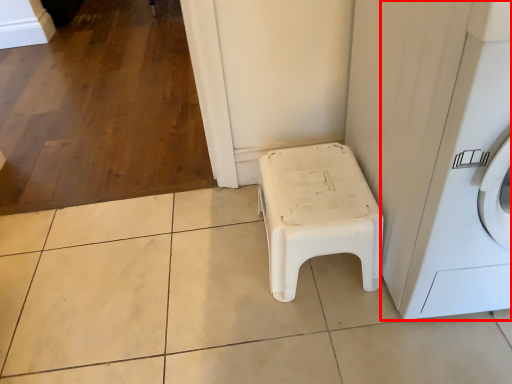
Question: Where is washing machine (annotated by the red box) located in relation to furniture in the image?

Choices:
 (A) left
 (B) right

Answer: (B)